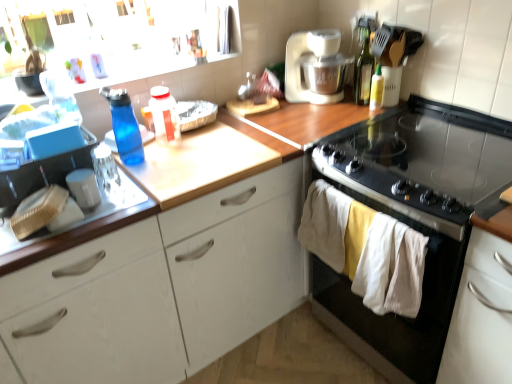
I want to click on vacant space situated on the left part of green glass bottle at upper right, arranged as the 2th bottle when viewed from the right, so click(333, 109).